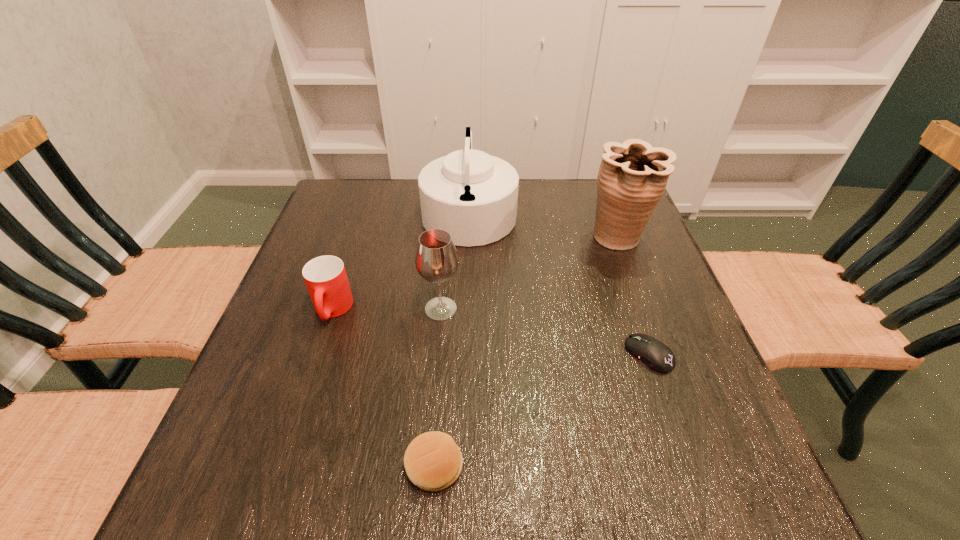
You are a GUI agent. You are given a task and a screenshot of the screen. Output one action in this format:
    pyautogui.click(x=<x>, y=<y>)
    Task: Click on the blank area located on the left of the urn
    
    Given the screenshot: What is the action you would take?
    pyautogui.click(x=446, y=237)

This screenshot has width=960, height=540. I want to click on vacant space located 0.250m on the front of the wineglass, so click(430, 436).

Where is `free space located 0.310m on the side of the fourth tallest object with the handle`? Image resolution: width=960 pixels, height=540 pixels. free space located 0.310m on the side of the fourth tallest object with the handle is located at coordinates (276, 483).

What are the coordinates of `free space located 0.150m on the right of the fifth tallest object` in the screenshot? It's located at (556, 466).

Find the location of a particular element. This screenshot has width=960, height=540. free location located on the left of the second nearest object is located at coordinates (511, 354).

I want to click on kettle that is positioned at the far edge, so click(472, 195).

Locate an element on the screen. This screenshot has width=960, height=540. urn that is positioned at the far edge is located at coordinates (632, 178).

Identify the location of object present at the near edge. (433, 462).

Find the location of a particular element. Image resolution: width=960 pixels, height=540 pixels. object that is at the left edge is located at coordinates (325, 276).

I want to click on urn that is at the right edge, so click(632, 178).